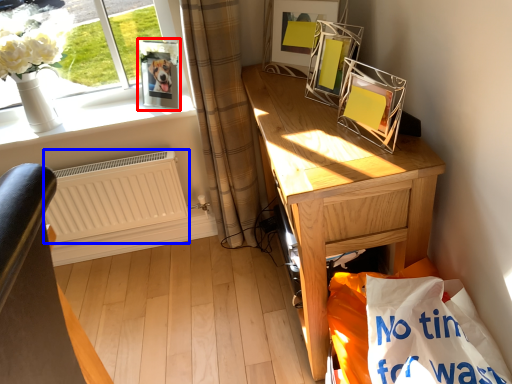
Question: Which object appears closest to the camera in this image, picture frame (highlighted by a red box) or radiator (highlighted by a blue box)?

Choices:
 (A) picture frame
 (B) radiator

Answer: (A)